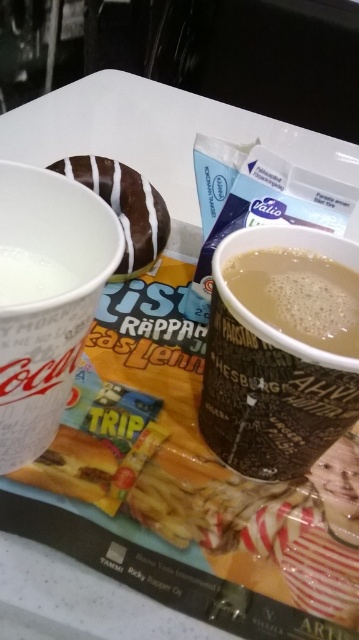
Question: Does brown paper cup at center appear on the left side of brown matte cup at center?

Choices:
 (A) no
 (B) yes

Answer: (B)

Question: Which of the following is the farthest from the observer?

Choices:
 (A) brown paper cup at center
 (B) brown matte cup at center
 (C) white paper cup at left

Answer: (B)

Question: Observing the image, what is the correct spatial positioning of brown paper cup at center in reference to white glossy donut at center?

Choices:
 (A) right
 (B) left

Answer: (A)

Question: Among these objects, which one is nearest to the camera?

Choices:
 (A) brown paper cup at center
 (B) brown matte cup at center
 (C) white glossy donut at center

Answer: (A)

Question: Which is farther from the white paper cup at left?

Choices:
 (A) brown matte cup at center
 (B) white glossy donut at center

Answer: (B)

Question: Is white paper cup at left thinner than white glossy donut at center?

Choices:
 (A) yes
 (B) no

Answer: (A)